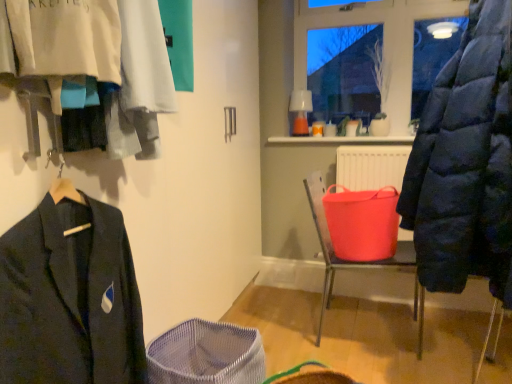
Where is `free space to the left of rubberized plastic bucket at center`? This screenshot has height=384, width=512. free space to the left of rubberized plastic bucket at center is located at coordinates (285, 325).